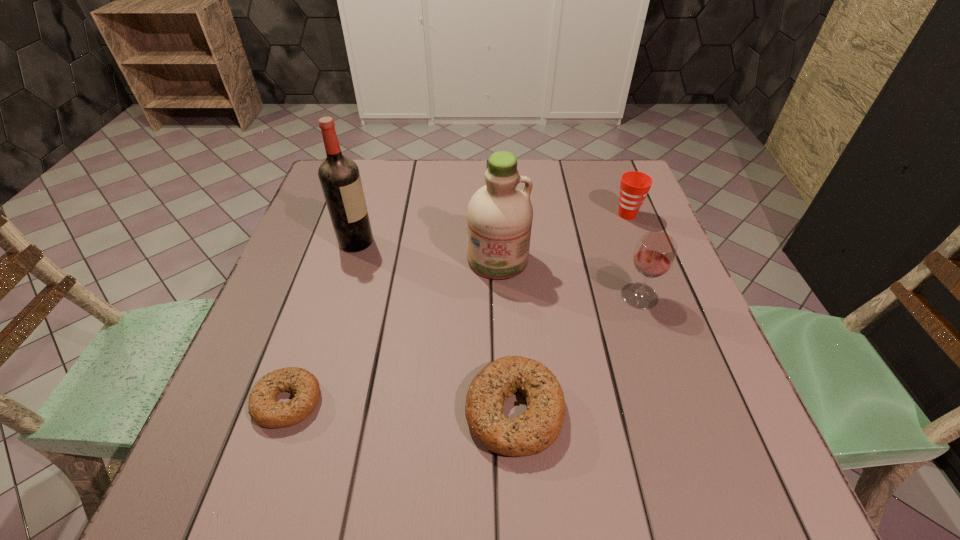
The image size is (960, 540). Find the location of `vacant position located on the right of the left bagel`. vacant position located on the right of the left bagel is located at coordinates (405, 401).

Locate an element on the screen. This screenshot has width=960, height=540. free point located 0.230m on the left of the taller bagel is located at coordinates (334, 410).

This screenshot has height=540, width=960. What are the coordinates of `free space located on the front label of the cleansing agent` in the screenshot? It's located at (502, 368).

This screenshot has width=960, height=540. I want to click on free space located 0.400m on the front-facing side of the liquor, so click(535, 242).

The width and height of the screenshot is (960, 540). I want to click on free region located on the left of the cup, so click(x=515, y=214).

Find the location of a particular element. free space located 0.190m on the left of the third tallest object is located at coordinates (535, 296).

You are a GUI agent. You are given a task and a screenshot of the screen. Output one action in this format:
    pyautogui.click(x=<x>, y=<y>)
    Task: Click on the object that is at the far edge
    This screenshot has width=960, height=540.
    Given the screenshot: What is the action you would take?
    pyautogui.click(x=634, y=186)

Locate an element on the screen. This screenshot has height=540, width=960. bagel located in the left edge section of the desktop is located at coordinates (264, 409).

Identify the location of liquor at the left edge. This screenshot has height=540, width=960. (339, 176).

Locate an element on the screen. cup situated at the right edge is located at coordinates (634, 186).